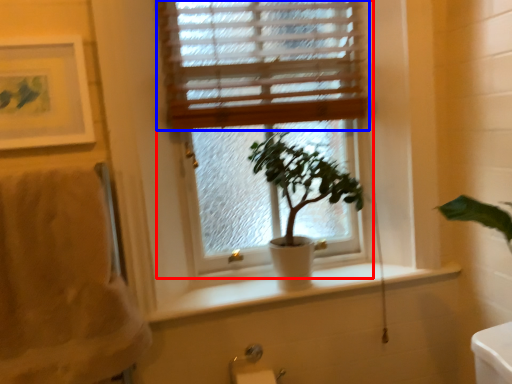
Question: Which object is closer to the camera taking this photo, window (highlighted by a red box) or window blind (highlighted by a blue box)?

Choices:
 (A) window
 (B) window blind

Answer: (A)